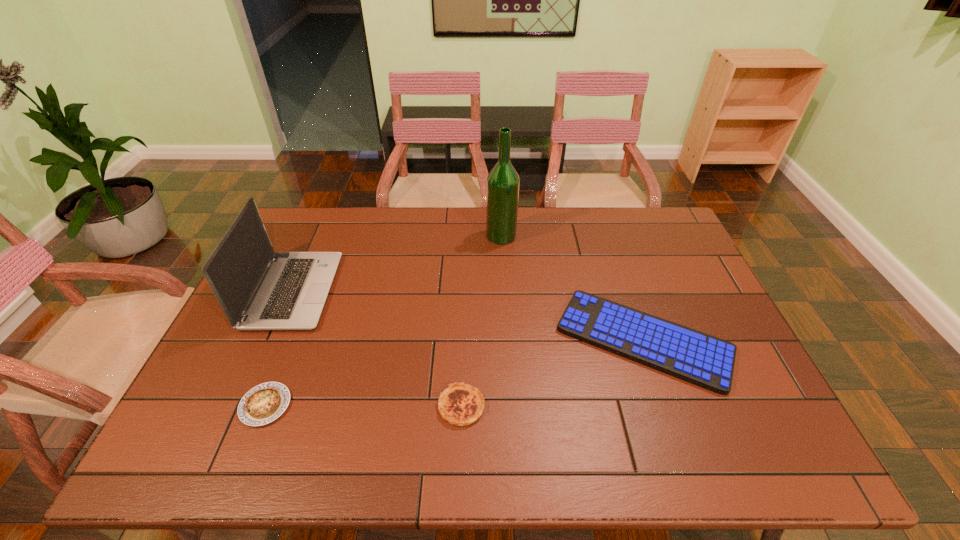
Locate an element on the screen. free spot located 0.120m on the back of the left quiche is located at coordinates 289,346.

At what (x,y) coordinates should I click in order to perform the action: click on object at the far edge. Please return your answer as a coordinate pair (x, y). Image resolution: width=960 pixels, height=540 pixels. Looking at the image, I should click on (503, 182).

At what (x,y) coordinates should I click in order to perform the action: click on laptop computer that is at the left edge. Please return your answer as a coordinate pair (x, y). This screenshot has height=540, width=960. Looking at the image, I should click on (258, 289).

You are a GUI agent. You are given a task and a screenshot of the screen. Output one action in this format:
    pyautogui.click(x=<x>, y=<y>)
    Task: Click on the quiche that is at the left edge
    The width and height of the screenshot is (960, 540).
    Given the screenshot: What is the action you would take?
    pyautogui.click(x=264, y=403)

Where is `object positioned at the right edge`? object positioned at the right edge is located at coordinates (704, 360).

What are the coordinates of `free space at the far edge of the desktop` in the screenshot? It's located at (621, 230).

Image resolution: width=960 pixels, height=540 pixels. In the image, there is a desktop. In order to click on vacant space at the near edge in this screenshot , I will do `click(297, 446)`.

The image size is (960, 540). What are the coordinates of `free spot at the left edge of the desktop` in the screenshot? It's located at (231, 423).

Find the location of a particular element. vacant space at the right edge is located at coordinates (678, 265).

The image size is (960, 540). In the image, there is a desktop. Identify the location of free space at the far left corner. (313, 227).